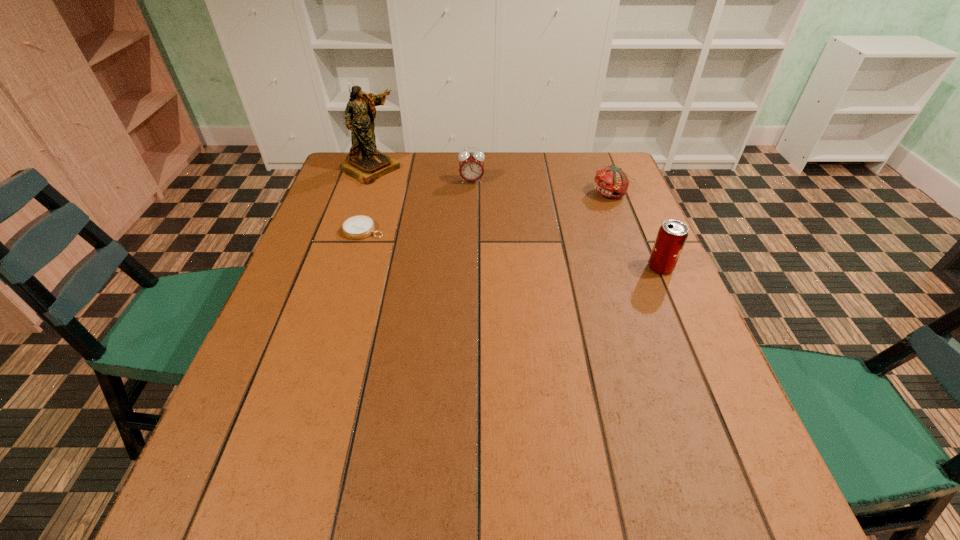
Find the location of a particular element. This screenshot has height=540, width=960. blank region between the shortest object and the second shortest object is located at coordinates (487, 212).

Where is `empty space between the shortest object and the nearest object`? empty space between the shortest object and the nearest object is located at coordinates (512, 249).

Identify which object is the nearest to the compass. Please provide its 2D coordinates. Your answer should be formatted as a tuple, i.e. [(x, y)], where the tuple contains the x and y coordinates of a point satisfying the conditions above.

[(366, 164)]

Identify which object is the fourth nearest to the alarm clock. Please provide its 2D coordinates. Your answer should be formatted as a tuple, i.e. [(x, y)], where the tuple contains the x and y coordinates of a point satisfying the conditions above.

[(672, 235)]

Locate an element on the screen. vacant area in the image that satisfies the following two spatial constraints: 1. on the front side of the tomato; 2. on the left side of the beer can is located at coordinates (638, 268).

The width and height of the screenshot is (960, 540). I want to click on free point that satisfies the following two spatial constraints: 1. on the back side of the compass; 2. on the left side of the tomato, so click(375, 193).

I want to click on vacant space that satisfies the following two spatial constraints: 1. on the back side of the fourth tallest object; 2. on the left side of the compass, so click(x=375, y=193).